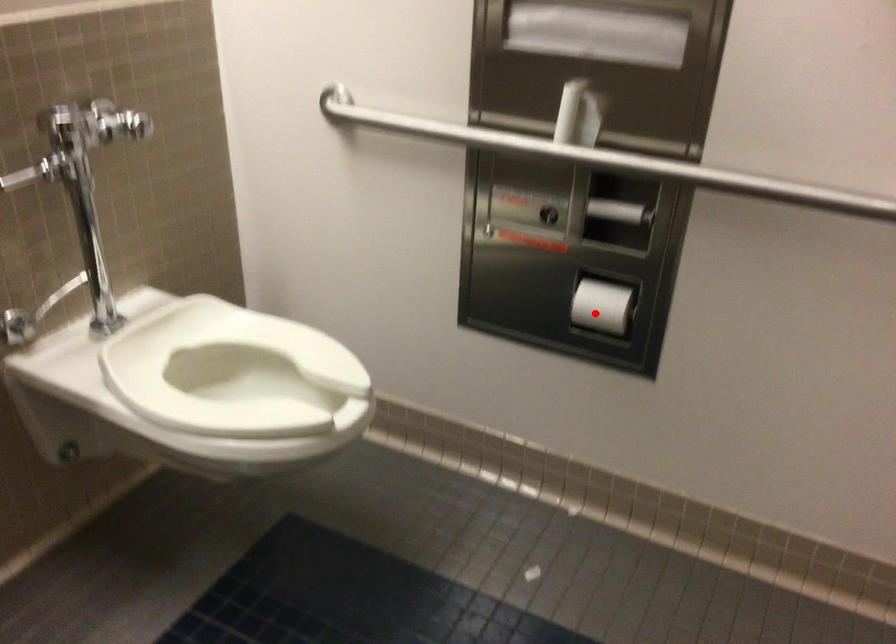
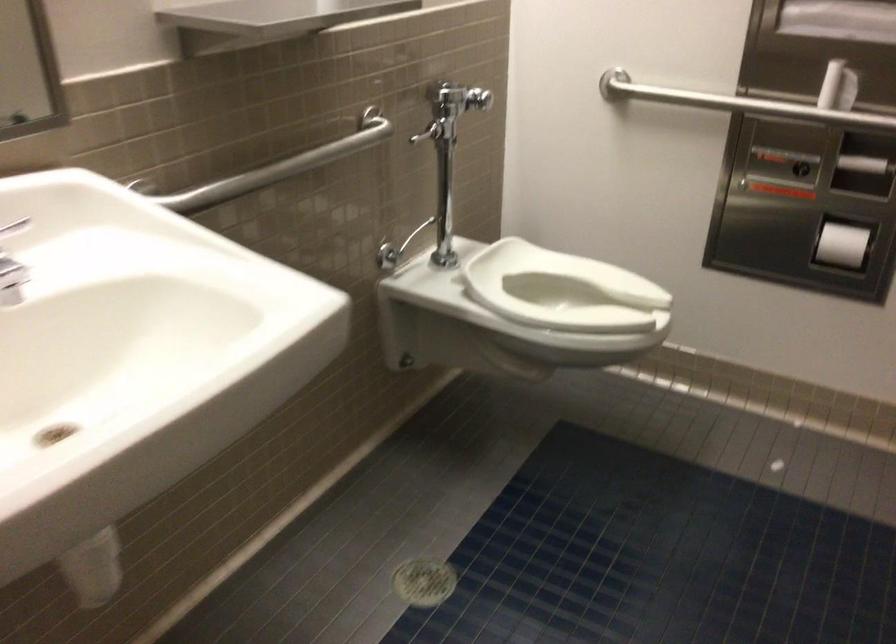
Where in the second image is the point corresponding to the highlighted location from the first image?

(841, 245)